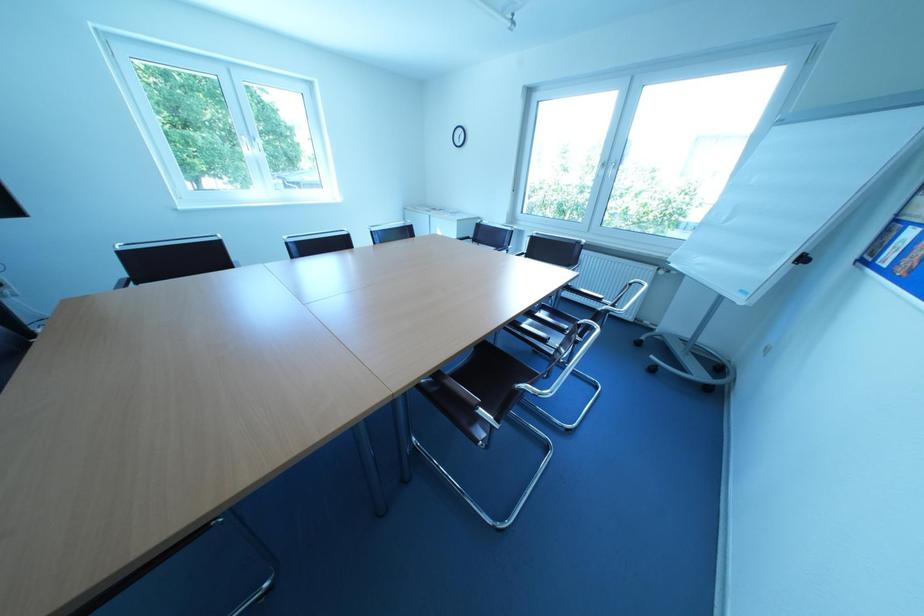
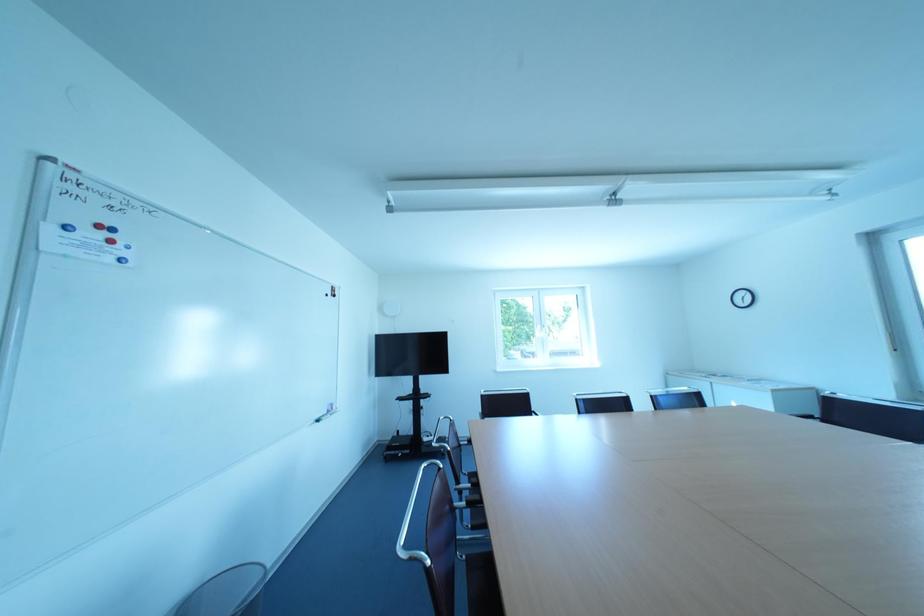
Consider the image. Based on the continuous images, in which direction is the camera rotating?

The camera rotated toward left-up.